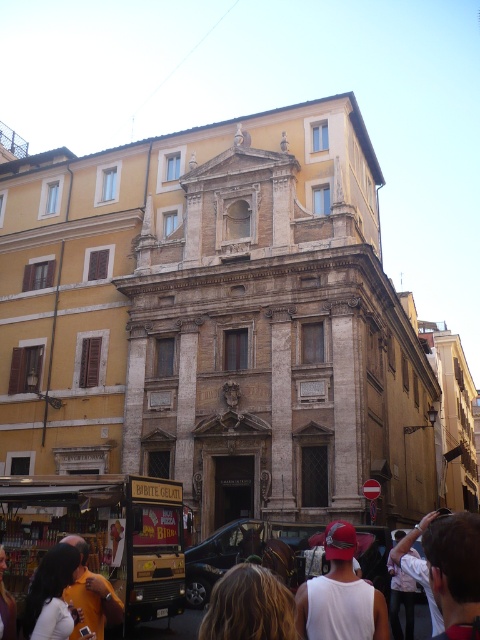
Question: Which of the following is the closest to the observer?

Choices:
 (A) (439, 570)
 (B) (309, 632)
 (C) (98, 616)
 (D) (35, 628)

Answer: (A)

Question: Which of the following is the farthest from the observer?

Choices:
 (A) (354, 573)
 (B) (452, 596)

Answer: (A)

Question: Can you confirm if blonde hair at lower center is positioned to the right of white cotton shirt at lower left?

Choices:
 (A) yes
 (B) no

Answer: (A)

Question: Is white matte hat at center thinner than yellow fabric backpack at lower left?

Choices:
 (A) no
 (B) yes

Answer: (A)

Question: Which is farther from the blonde hair at lower center?

Choices:
 (A) yellow fabric backpack at lower left
 (B) white cotton shirt at lower left
 (C) white matte hat at center

Answer: (B)

Question: Is dark hair at lower right smaller than yellow fabric backpack at lower left?

Choices:
 (A) no
 (B) yes

Answer: (A)